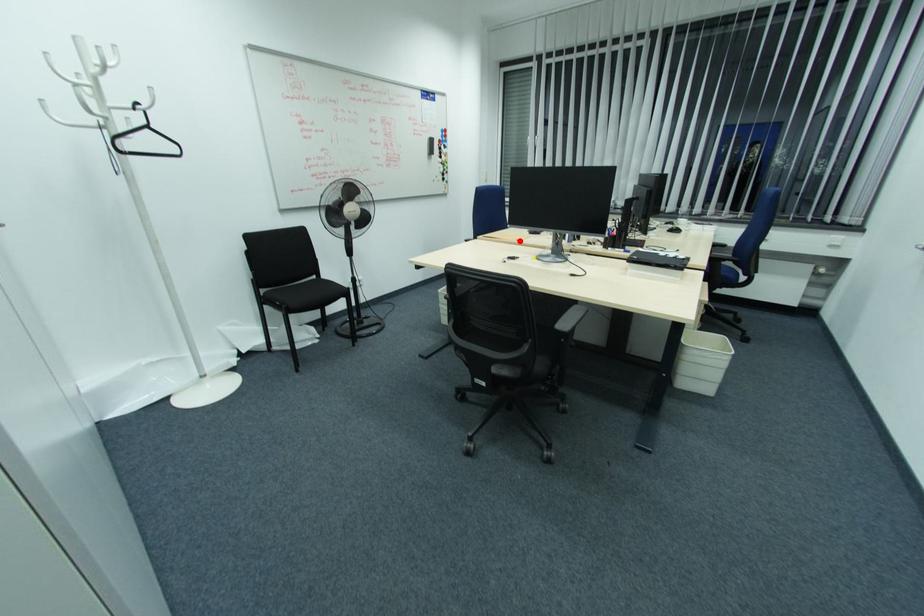
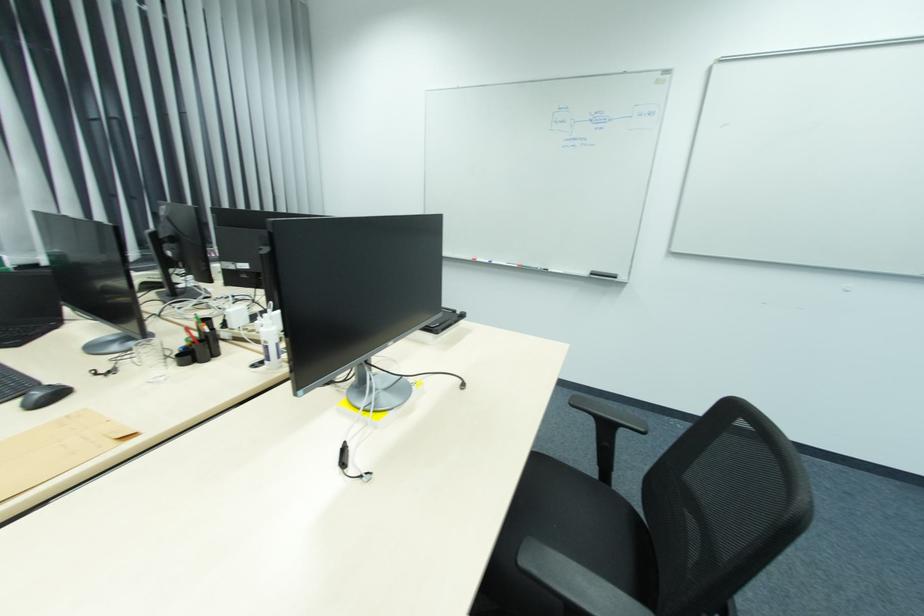
Find the pixel in the second image that matches the highlighted location in the first image.

(129, 436)